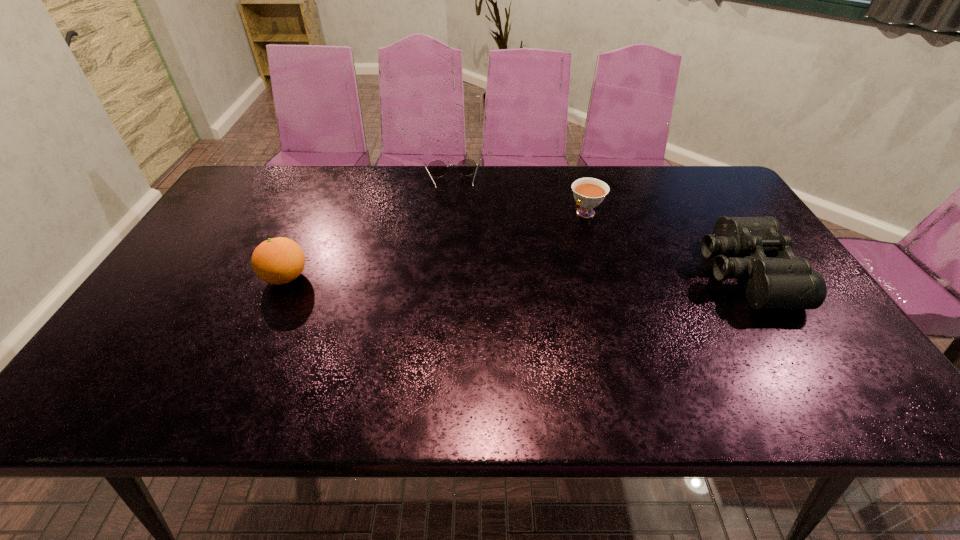
Where is `object that is the third closest to the spectacles`? object that is the third closest to the spectacles is located at coordinates (786, 281).

Select which object is the third closest to the leftmost object. Please provide its 2D coordinates. Your answer should be formatted as a tuple, i.e. [(x, y)], where the tuple contains the x and y coordinates of a point satisfying the conditions above.

[(786, 281)]

Where is `vacant space that satisfies the following two spatial constraints: 1. on the back side of the rightmost object; 2. at the eyepieces of the leftmost object`? vacant space that satisfies the following two spatial constraints: 1. on the back side of the rightmost object; 2. at the eyepieces of the leftmost object is located at coordinates 288,273.

The width and height of the screenshot is (960, 540). What are the coordinates of `free location that satisfies the following two spatial constraints: 1. on the front side of the binoculars; 2. at the eyepieces of the third nearest object` in the screenshot? It's located at (603, 273).

Locate an element on the screen. free spot that satisfies the following two spatial constraints: 1. on the back side of the orange; 2. at the eyepieces of the rightmost object is located at coordinates (288, 273).

Locate an element on the screen. Image resolution: width=960 pixels, height=540 pixels. vacant area that satisfies the following two spatial constraints: 1. on the back side of the rightmost object; 2. at the eyepieces of the orange is located at coordinates (288, 273).